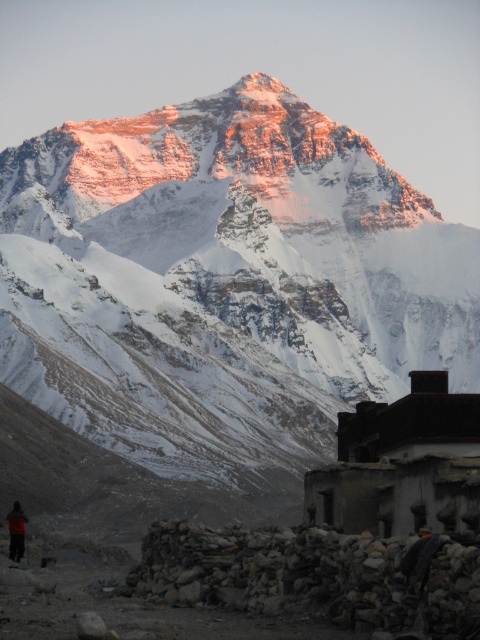
From the picture: You are a hiker who has just reached the base of Mount Everest. You notice a rustic stone hut at lower right and an orange fabric jacket at lower left. Which object is positioned higher up the mountain?

The rustic stone hut at lower right is located above the orange fabric jacket at lower left, so the rustic stone hut at lower right is positioned higher up the mountain.

You are a mountaineer planning to set up camp near the snowy rock mountain at center. Given that the mountain is at coordinate point 0.450, 0.467, where would you place your tent to ensure it is not directly under the mountain? Please provide coordinates that are at least 0.1 units away from the mountain.

The snowy rock mountain at center is located at coordinate point (224,288). To place the tent at least 0.1 units away, suitable coordinates could be (224,352), which is 0.1 units to the east of the mountain. Alternatively, (272,288) would be 0.1 units north, or (224,224) to the west, or (176,288) to the south. Any of these positions would ensure the tent is not directly under the mountain.